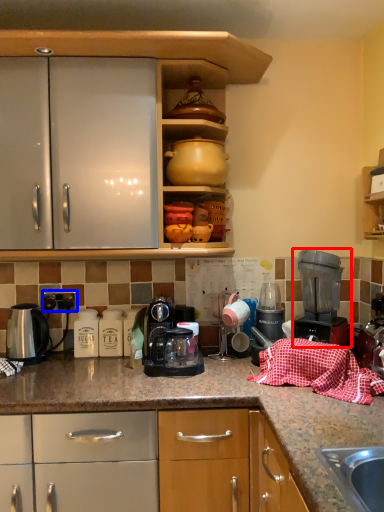
Question: Which object appears farthest to the camera in this image, home appliance (highlighted by a red box) or electric outlet (highlighted by a blue box)?

Choices:
 (A) home appliance
 (B) electric outlet

Answer: (B)